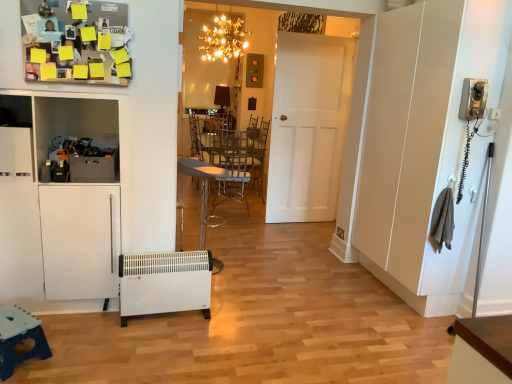
Question: From a real-world perspective, is gold metallic chandelier at upper center physically located above or below blue plastic table at lower left, which is the 2th table from right to left?

Choices:
 (A) below
 (B) above

Answer: (B)

Question: In terms of width, does gold metallic chandelier at upper center look wider or thinner when compared to blue plastic table at lower left, the first table from the front?

Choices:
 (A) thin
 (B) wide

Answer: (B)

Question: Which is farther from the white plastic heater at lower left?

Choices:
 (A) white matte door at center
 (B) gold metallic chandelier at upper center
 (C) metallic silver table at center, acting as the 1th table starting from the back
 (D) metallic silver chair at center
 (E) blue plastic table at lower left, the first table from the front

Answer: (B)

Question: Which is nearer to the white matte door at center?

Choices:
 (A) white plastic heater at lower left
 (B) metallic silver chair at center
 (C) gold metallic chandelier at upper center
 (D) metallic silver table at center, positioned as the 1th table in top-to-bottom order
 (E) blue plastic table at lower left, which is the 1th table in left-to-right order

Answer: (D)